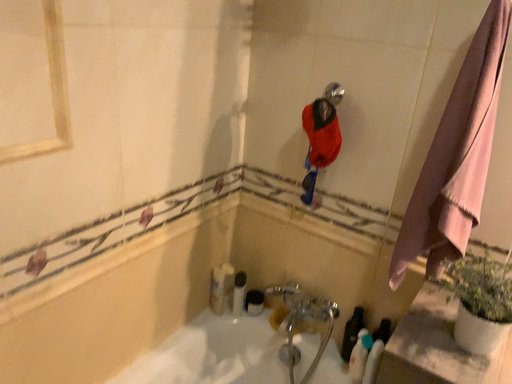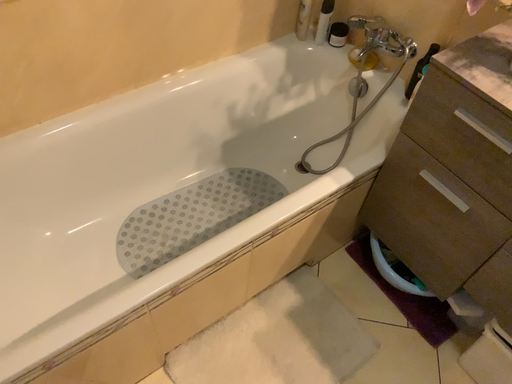
Question: Which way did the camera rotate in the video?

Choices:
 (A) rotated upward
 (B) rotated downward

Answer: (B)